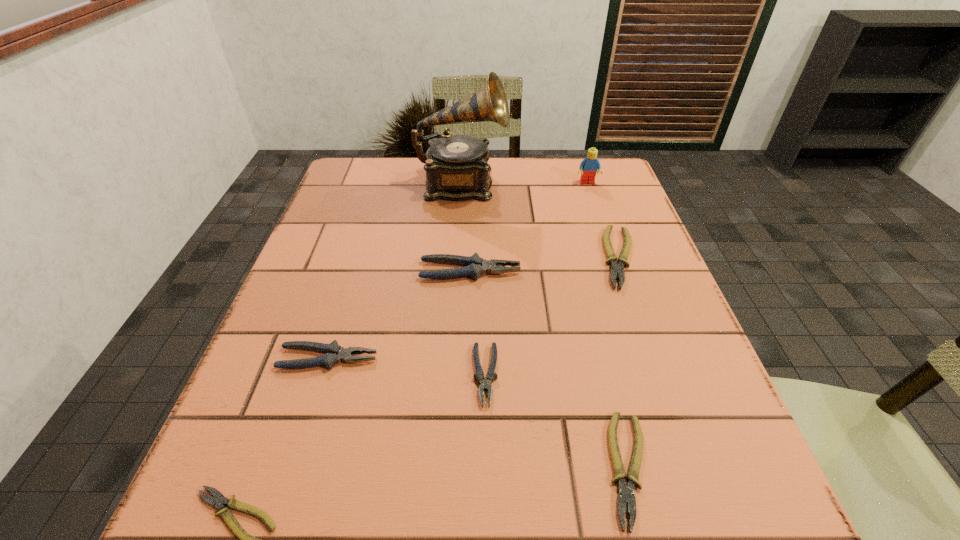
At what (x,y) coordinates should I click in order to perform the action: click on object identified as the closest to the leftmost gray pliers. Please return your answer as a coordinate pair (x, y). Looking at the image, I should click on (486, 383).

Locate an element on the screen. The height and width of the screenshot is (540, 960). pliers that is the closest to the rightmost pliers is located at coordinates (476, 266).

Identify which pliers is located as the fourth nearest to the shortest pliers. Please provide its 2D coordinates. Your answer should be formatted as a tuple, i.e. [(x, y)], where the tuple contains the x and y coordinates of a point satisfying the conditions above.

[(626, 493)]

I want to click on gray pliers that is the third closest to the shortest pliers, so click(476, 266).

Locate an element on the screen. The image size is (960, 540). gray pliers that is the second nearest to the Lego is located at coordinates (486, 383).

Locate an element on the screen. yellow pliers that stands as the third closest to the phonograph record is located at coordinates (219, 500).

At what (x,y) coordinates should I click in order to perform the action: click on yellow pliers that is the closest to the shortest pliers. Please return your answer as a coordinate pair (x, y). Looking at the image, I should click on (626, 493).

This screenshot has height=540, width=960. In order to click on free space that satisfies the following two spatial constraints: 1. on the front side of the farthest yellow pliers; 2. at the gripping part of the fifth shortest object in this screenshot , I will do `click(656, 359)`.

This screenshot has width=960, height=540. What are the coordinates of `free space that satisfies the following two spatial constraints: 1. on the face of the Lego; 2. on the horn of the phonograph record` in the screenshot? It's located at (588, 185).

You are a GUI agent. You are given a task and a screenshot of the screen. Output one action in this format:
    pyautogui.click(x=<x>, y=<y>)
    Task: Click on the free space that satisfies the following two spatial constraints: 1. on the back side of the second biggest yellow pliers; 2. on the horn of the phonograph record
    Image resolution: width=960 pixels, height=540 pixels.
    Given the screenshot: What is the action you would take?
    pyautogui.click(x=559, y=185)